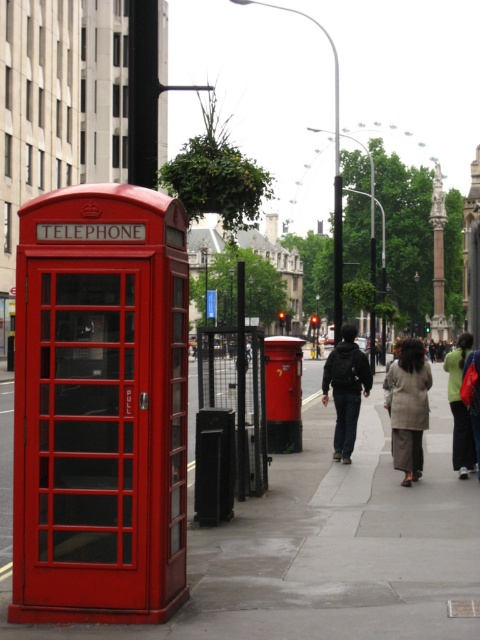
Question: Based on their relative distances, which object is farther from the smooth concrete sidewalk at center?

Choices:
 (A) light beige fabric coat at center
 (B) dark gray fabric jacket at center

Answer: (A)

Question: Is smooth concrete sidewalk at center bigger than dark gray fabric coat at center?

Choices:
 (A) no
 (B) yes

Answer: (B)

Question: Based on their relative distances, which object is farther from the light beige fabric coat at center?

Choices:
 (A) smooth concrete sidewalk at center
 (B) dark gray fabric coat at center
 (C) matte red telephone at left

Answer: (C)

Question: Can you confirm if light beige fabric coat at center is positioned to the left of dark gray fabric coat at center?

Choices:
 (A) no
 (B) yes

Answer: (B)

Question: Is smooth concrete sidewalk at center bigger than dark gray fabric coat at center?

Choices:
 (A) no
 (B) yes

Answer: (B)

Question: Among these objects, which one is nearest to the camera?

Choices:
 (A) dark gray fabric jacket at center
 (B) smooth concrete sidewalk at center

Answer: (B)